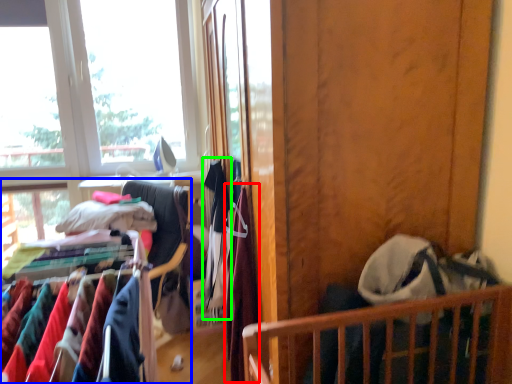
Question: Which object is the closest to the clothing (highlighted by a red box)? Choose among these: closet (highlighted by a blue box) or clothing (highlighted by a green box).

Choices:
 (A) closet
 (B) clothing

Answer: (B)